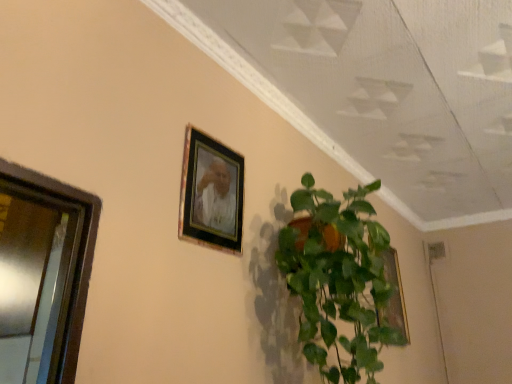
Question: Is green glossy plant at center positioned beyond the bounds of wooden frame at upper center, positioned as the 2th picture frame in back-to-front order?

Choices:
 (A) yes
 (B) no

Answer: (A)

Question: Is green glossy plant at center to the left of wooden frame at upper center, the 2th picture frame from the right, from the viewer's perspective?

Choices:
 (A) yes
 (B) no

Answer: (B)

Question: Can you confirm if green glossy plant at center is positioned to the right of wooden frame at upper center, which is the first picture frame from front to back?

Choices:
 (A) no
 (B) yes

Answer: (B)

Question: Considering the relative sizes of green glossy plant at center and wooden frame at upper center, the second picture frame in the bottom-to-top sequence, in the image provided, is green glossy plant at center smaller than wooden frame at upper center, the second picture frame in the bottom-to-top sequence,?

Choices:
 (A) no
 (B) yes

Answer: (A)

Question: From a real-world perspective, is green glossy plant at center located beneath wooden frame at upper center, the 1th picture frame positioned from the top?

Choices:
 (A) yes
 (B) no

Answer: (A)

Question: Choose the correct answer: Is metallic glass window at left inside green glossy plant at center or outside it?

Choices:
 (A) outside
 (B) inside

Answer: (A)

Question: Considering the positions of metallic glass window at left and green glossy plant at center in the image, is metallic glass window at left wider or thinner than green glossy plant at center?

Choices:
 (A) wide
 (B) thin

Answer: (B)

Question: In the image, is metallic glass window at left positioned in front of or behind green glossy plant at center?

Choices:
 (A) behind
 (B) front

Answer: (B)

Question: Considering the relative positions of metallic glass window at left and green glossy plant at center in the image provided, is metallic glass window at left to the left or to the right of green glossy plant at center?

Choices:
 (A) left
 (B) right

Answer: (A)

Question: Choose the correct answer: Is metallic glass window at left inside gold metallic picture frame at upper right, which is counted as the 2th picture frame, starting from the front, or outside it?

Choices:
 (A) outside
 (B) inside

Answer: (A)

Question: Looking at their shapes, would you say metallic glass window at left is wider or thinner than gold metallic picture frame at upper right, the first picture frame ordered from the bottom?

Choices:
 (A) thin
 (B) wide

Answer: (B)

Question: From a real-world perspective, is metallic glass window at left above or below gold metallic picture frame at upper right, the 2th picture frame when ordered from left to right?

Choices:
 (A) above
 (B) below

Answer: (B)

Question: Considering the positions of metallic glass window at left and gold metallic picture frame at upper right, which is counted as the 2th picture frame, starting from the front, in the image, is metallic glass window at left taller or shorter than gold metallic picture frame at upper right, which is counted as the 2th picture frame, starting from the front,?

Choices:
 (A) tall
 (B) short

Answer: (B)

Question: Visually, is wooden frame at upper center, the 1th picture frame positioned from the left, positioned to the left or to the right of metallic glass window at left?

Choices:
 (A) right
 (B) left

Answer: (A)

Question: From the image's perspective, is wooden frame at upper center, positioned as the 2th picture frame in back-to-front order, positioned above or below metallic glass window at left?

Choices:
 (A) above
 (B) below

Answer: (A)